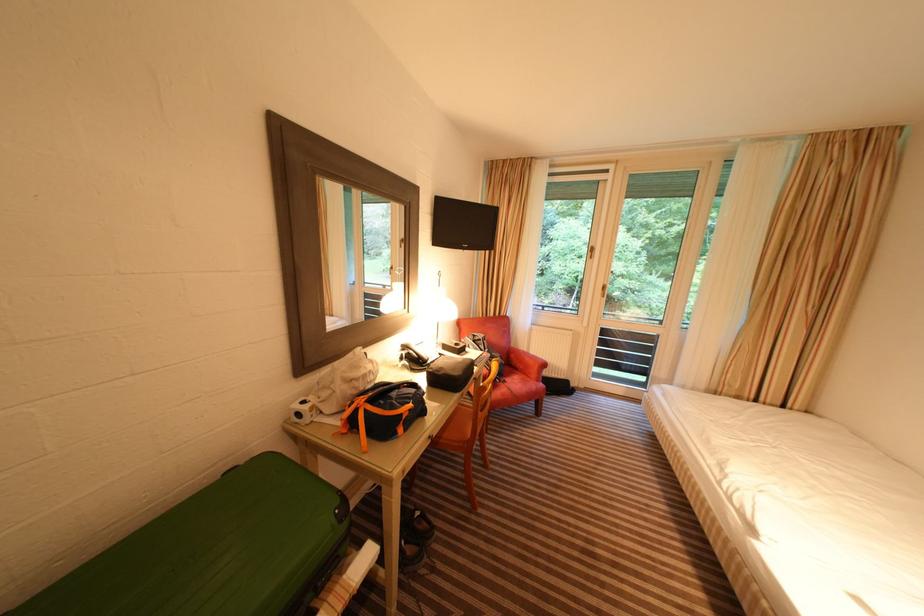
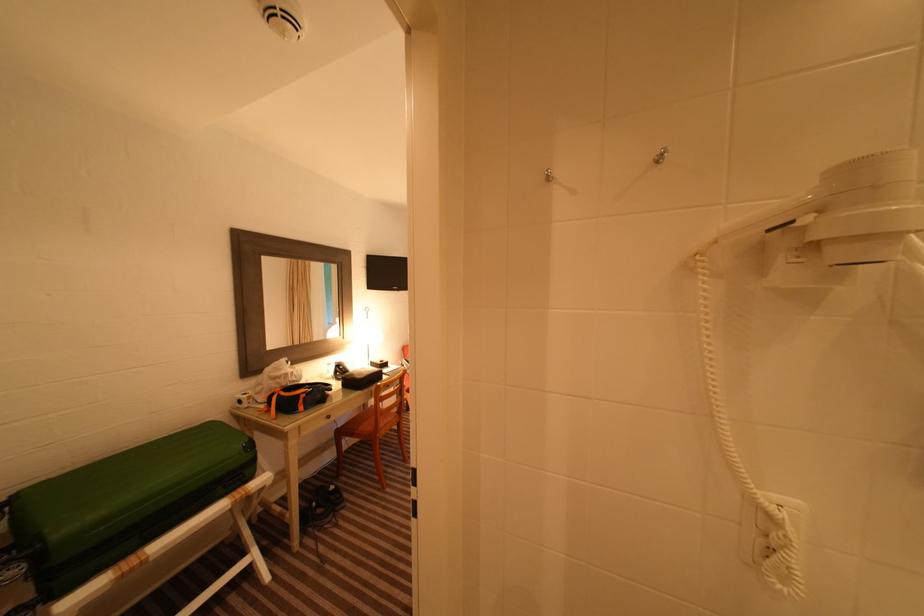
Locate, in the second image, the point that corresponds to [362,411] in the first image.

(280, 397)